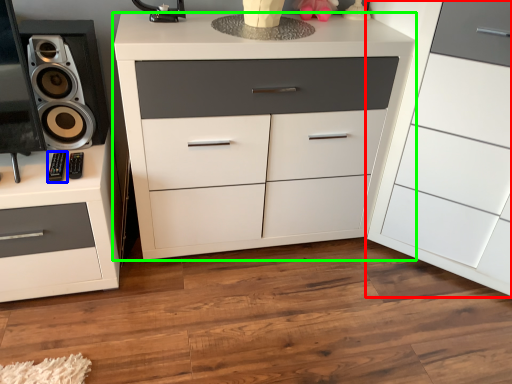
Question: Which is farther away from chest of drawers (highlighted by a red box)? control (highlighted by a blue box) or chest of drawers (highlighted by a green box)?

Choices:
 (A) control
 (B) chest of drawers

Answer: (A)